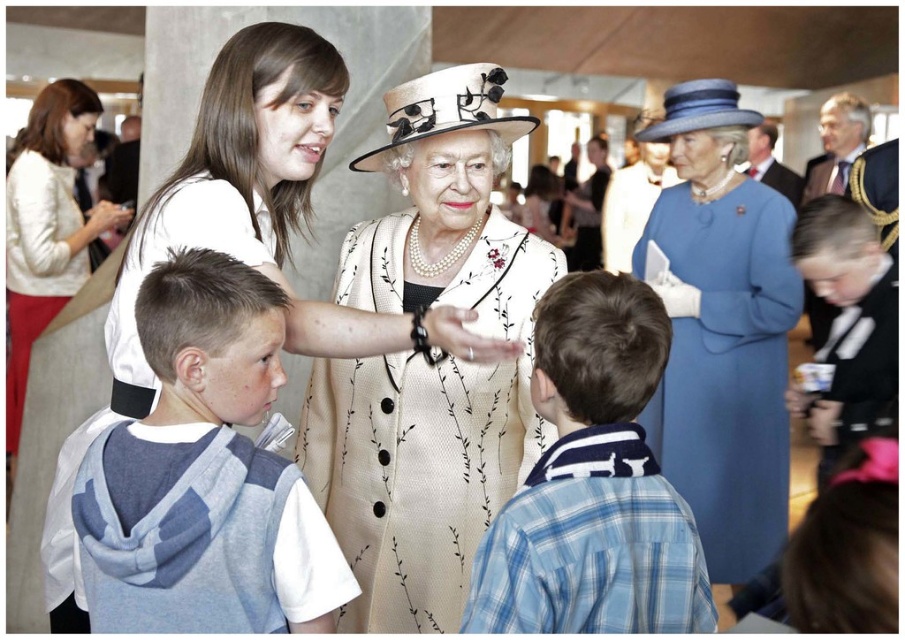
Question: Does gray cotton hoodie at center have a greater width compared to blue woolen dress at center?

Choices:
 (A) yes
 (B) no

Answer: (B)

Question: Can you confirm if beige textured coat at center is positioned below blue plaid shirt at center?

Choices:
 (A) no
 (B) yes

Answer: (B)

Question: Which object is the closest to the white textured sweater at upper left?

Choices:
 (A) blue plaid shirt at center
 (B) matte white dress at center

Answer: (B)

Question: Among these objects, which one is farthest from the camera?

Choices:
 (A) blue plaid shirt at center
 (B) beige textured coat at center
 (C) matte white dress at center

Answer: (B)

Question: In this image, where is gray cotton hoodie at center located relative to blue plaid shirt at center?

Choices:
 (A) above
 (B) below

Answer: (A)

Question: Which object appears closest to the camera in this image?

Choices:
 (A) blue woolen dress at center
 (B) beige textured coat at center
 (C) matte white dress at center
 (D) blue plaid shirt at center

Answer: (D)